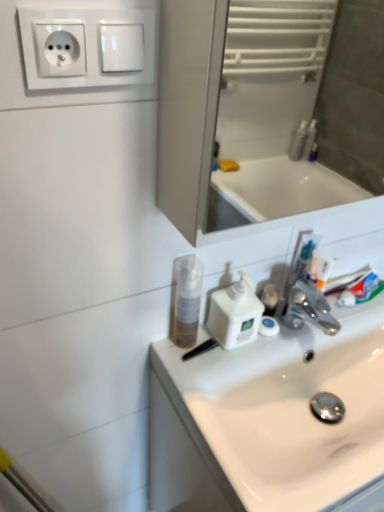
Question: Is white plastic socket at upper left positioned with its back to translucent plastic mouthwash at sink?

Choices:
 (A) no
 (B) yes

Answer: (A)

Question: Would you say white plastic socket at upper left contains translucent plastic mouthwash at sink?

Choices:
 (A) no
 (B) yes

Answer: (A)

Question: Considering the relative sizes of white plastic socket at upper left and translucent plastic mouthwash at sink in the image provided, is white plastic socket at upper left smaller than translucent plastic mouthwash at sink?

Choices:
 (A) no
 (B) yes

Answer: (B)

Question: Can you confirm if white plastic socket at upper left is wider than translucent plastic mouthwash at sink?

Choices:
 (A) yes
 (B) no

Answer: (B)

Question: Is white plastic socket at upper left outside of translucent plastic mouthwash at sink?

Choices:
 (A) no
 (B) yes

Answer: (B)

Question: From a real-world perspective, is white glossy sink at center physically located above or below white plastic soap dispenser at center?

Choices:
 (A) above
 (B) below

Answer: (B)

Question: Considering the positions of white glossy sink at center and white plastic soap dispenser at center in the image, is white glossy sink at center wider or thinner than white plastic soap dispenser at center?

Choices:
 (A) wide
 (B) thin

Answer: (A)

Question: Considering the positions of point (284, 367) and point (231, 343), is point (284, 367) closer or farther from the camera than point (231, 343)?

Choices:
 (A) closer
 (B) farther

Answer: (B)

Question: Looking at the image, does white glossy sink at center seem bigger or smaller compared to white plastic soap dispenser at center?

Choices:
 (A) small
 (B) big

Answer: (B)

Question: Considering the relative positions of white plastic soap dispenser at center and white glossy sink at center in the image provided, is white plastic soap dispenser at center to the left or to the right of white glossy sink at center?

Choices:
 (A) right
 (B) left

Answer: (B)

Question: Is white plastic soap dispenser at center wider or thinner than white glossy sink at center?

Choices:
 (A) wide
 (B) thin

Answer: (B)

Question: Is point (251, 305) closer or farther from the camera than point (347, 262)?

Choices:
 (A) closer
 (B) farther

Answer: (A)

Question: From a real-world perspective, relative to white glossy sink at center, is white plastic soap dispenser at center vertically above or below?

Choices:
 (A) above
 (B) below

Answer: (A)

Question: In terms of size, does translucent plastic mouthwash at sink appear bigger or smaller than white glossy sink at center?

Choices:
 (A) small
 (B) big

Answer: (A)

Question: Considering the relative positions of translucent plastic mouthwash at sink and white glossy sink at center in the image provided, is translucent plastic mouthwash at sink to the left or to the right of white glossy sink at center?

Choices:
 (A) left
 (B) right

Answer: (A)